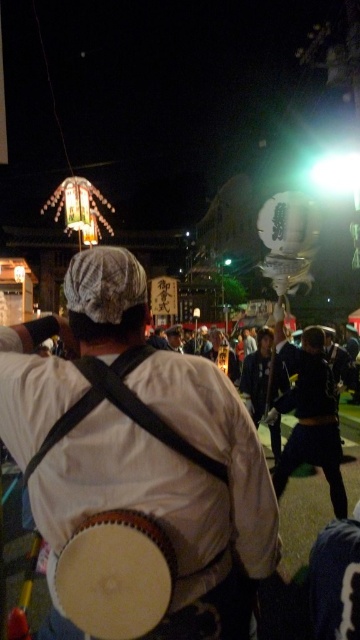
Between white fabric drum at center and dark blue fabric pants at lower right, which one appears on the left side from the viewer's perspective?

Positioned to the left is white fabric drum at center.

Is white fabric drum at center positioned at the back of dark blue fabric pants at lower right?

That is False.

Is point (228, 513) less distant than point (327, 426)?

Yes.

Identify the location of white fabric drum at center. Image resolution: width=360 pixels, height=640 pixels. (173, 490).

Is white fabric drum at center to the right of white drum at center from the viewer's perspective?

In fact, white fabric drum at center is to the left of white drum at center.

Who is more distant from viewer, [149,486] or [102,516]?

Positioned behind is point [149,486].

Is point (29, 451) farther from viewer compared to point (158, 524)?

That is True.

This screenshot has height=640, width=360. What are the coordinates of `white fabric drum at center` in the screenshot? It's located at (173, 490).

Is white drum at center to the right of dark blue fabric pants at lower right from the viewer's perspective?

No, white drum at center is not to the right of dark blue fabric pants at lower right.

Between white drum at center and dark blue fabric pants at lower right, which one appears on the left side from the viewer's perspective?

white drum at center is more to the left.

Is point (105, 593) positioned in front of point (309, 355)?

Yes, it is in front of point (309, 355).

Locate an element on the screen. white drum at center is located at coordinates (115, 576).